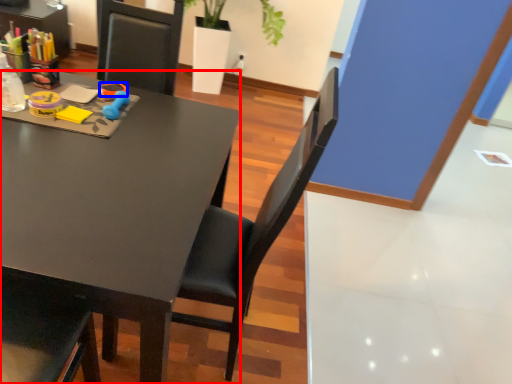
Question: Which of the following is the closest to the observer, desk (highlighted by a red box) or scissors (highlighted by a blue box)?

Choices:
 (A) desk
 (B) scissors

Answer: (A)